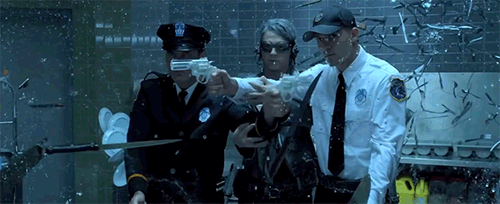
Locate an element on the screen. This screenshot has height=204, width=500. plates is located at coordinates (101, 117), (111, 116), (111, 132), (119, 170).